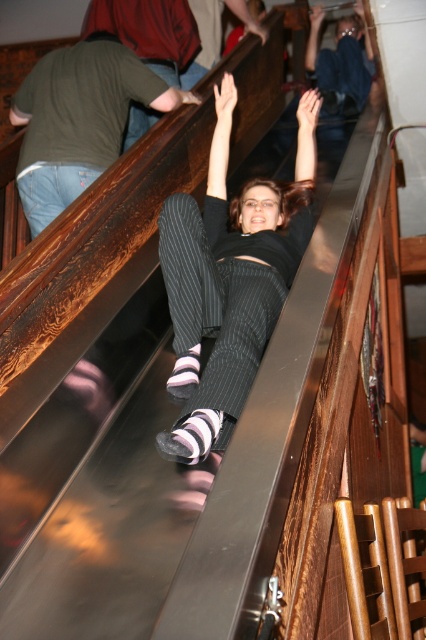
Who is lower down, black pinstripe pants at center or jeans at left?

Positioned lower is black pinstripe pants at center.

Is point (192, 204) behind point (77, 189)?

No, (192, 204) is in front of (77, 189).

Measure the distance between point (235,205) and camera.

Point (235,205) is 11.83 feet from camera.

At what (x,y) coordinates should I click in order to perform the action: click on black pinstripe pants at center. Please return your answer as a coordinate pair (x, y). Looking at the image, I should click on (230, 278).